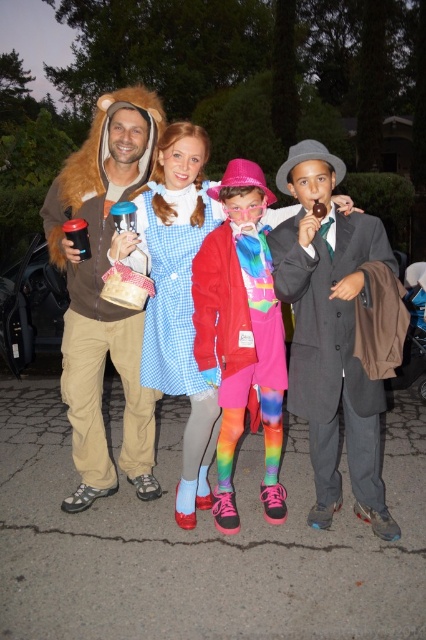
You are organizing a group photo and need to arrange the matte blue dress at center and the fuzzy brown coat at left side by side. Which one requires more space horizontally?

The matte blue dress at center requires more horizontal space because its width surpasses that of the fuzzy brown coat at left.

You are a photographer taking a picture of the matte blue dress at center and the rainbow tights at center. Which one should you focus on first if you want to capture both in the frame?

The matte blue dress at center is positioned on the left side of rainbow tights at center, so you should focus on the matte blue dress at center first to ensure both are in frame.